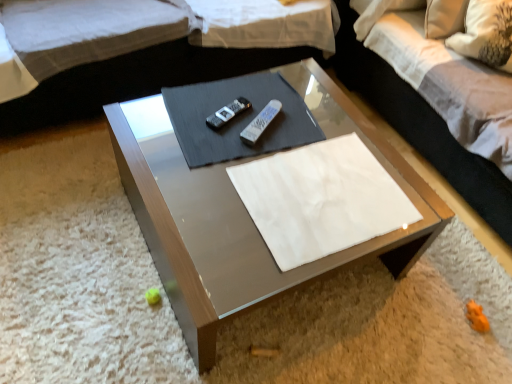
Identify the location of unoccupied area behind white plastic remote at center, which is the second remote from left to right. (273, 91).